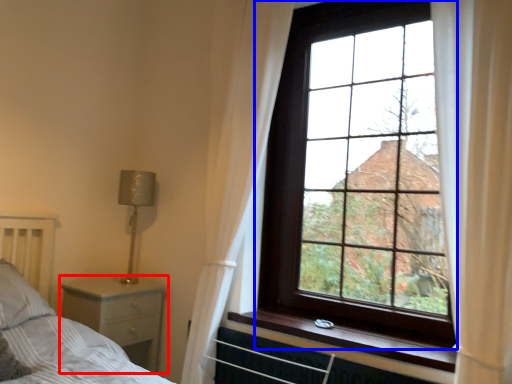
Question: Among these objects, which one is nearest to the camera, nightstand (highlighted by a red box) or window (highlighted by a blue box)?

Choices:
 (A) nightstand
 (B) window

Answer: (B)